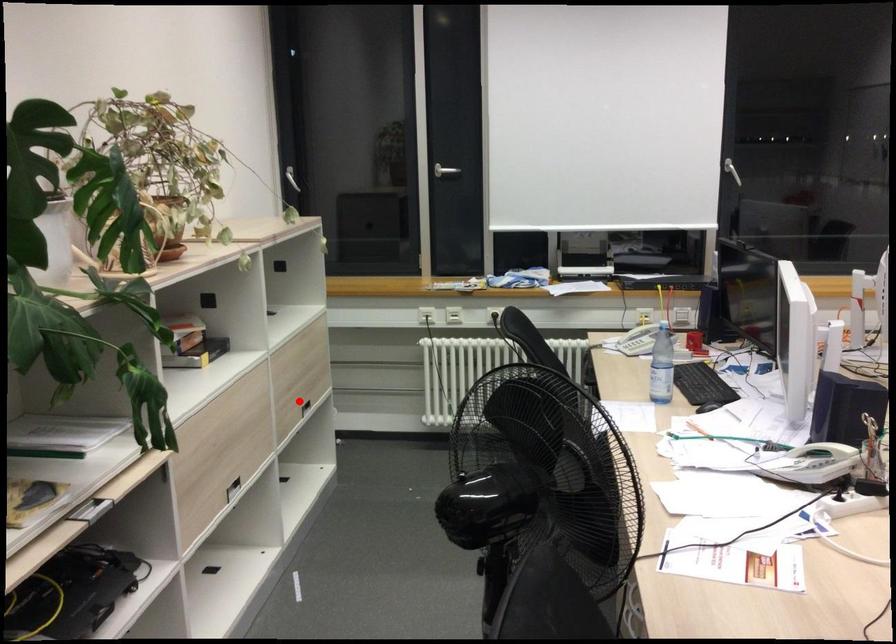
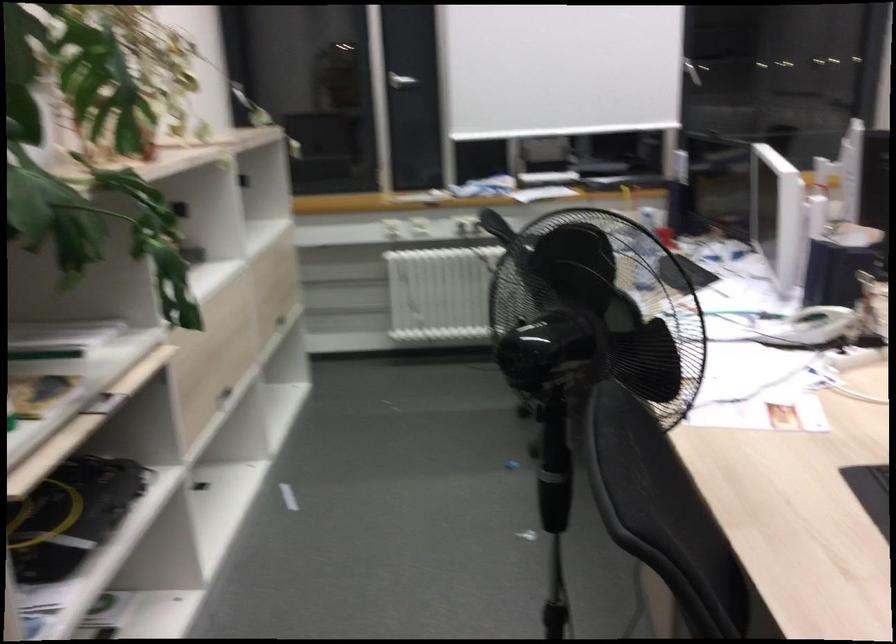
Where in the second image is the point corresponding to the highlighted location from the first image?

(276, 313)